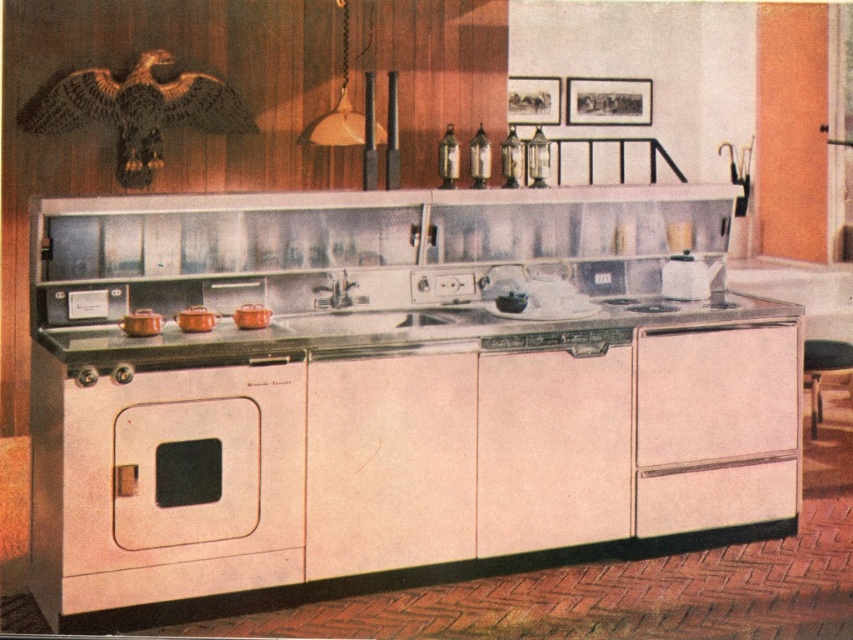
Between metallic silver counter top at center and golden metallic eagle at upper left, which one has less height?

metallic silver counter top at center

Can you confirm if metallic silver counter top at center is positioned above golden metallic eagle at upper left?

Incorrect, metallic silver counter top at center is not positioned above golden metallic eagle at upper left.

The height and width of the screenshot is (640, 853). Describe the element at coordinates (399, 332) in the screenshot. I see `metallic silver counter top at center` at that location.

Identify the location of metallic silver counter top at center. (399, 332).